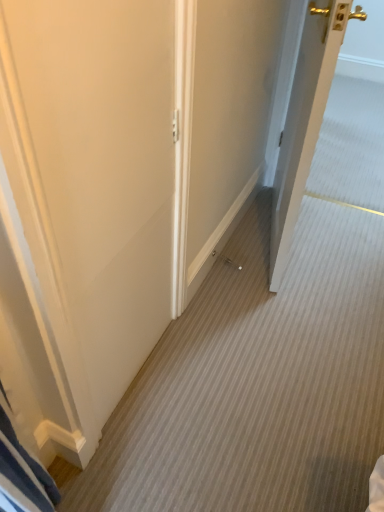
Question: Which direction should I rotate to look at white matte door at center, marked as the second door in a right-to-left arrangement, — up or down?

Choices:
 (A) down
 (B) up

Answer: (B)

Question: From a real-world perspective, is white wood door at right, placed as the 2th door when sorted from left to right, beneath white matte door at center, marked as the second door in a right-to-left arrangement?

Choices:
 (A) yes
 (B) no

Answer: (A)

Question: Is white wood door at right, the first door positioned from the right, further to camera compared to white matte door at center, the 1th door when ordered from left to right?

Choices:
 (A) no
 (B) yes

Answer: (B)

Question: Does white wood door at right, the first door positioned from the right, have a greater width compared to white matte door at center, marked as the second door in a right-to-left arrangement?

Choices:
 (A) no
 (B) yes

Answer: (B)

Question: From the image's perspective, is white wood door at right, the first door positioned from the right, above white matte door at center, marked as the second door in a right-to-left arrangement?

Choices:
 (A) no
 (B) yes

Answer: (B)

Question: Considering the relative sizes of white wood door at right, placed as the 2th door when sorted from left to right, and white matte door at center, the 1th door when ordered from left to right, in the image provided, is white wood door at right, placed as the 2th door when sorted from left to right, smaller than white matte door at center, the 1th door when ordered from left to right,?

Choices:
 (A) yes
 (B) no

Answer: (B)

Question: Is white wood door at right, placed as the 2th door when sorted from left to right, to the left of white matte door at center, marked as the second door in a right-to-left arrangement, from the viewer's perspective?

Choices:
 (A) no
 (B) yes

Answer: (A)

Question: Does white matte door at center, the 1th door when ordered from left to right, have a larger size compared to white wood door at right, placed as the 2th door when sorted from left to right?

Choices:
 (A) yes
 (B) no

Answer: (B)

Question: From a real-world perspective, is white matte door at center, marked as the second door in a right-to-left arrangement, located higher than white wood door at right, the first door positioned from the right?

Choices:
 (A) no
 (B) yes

Answer: (B)

Question: From the image's perspective, is white matte door at center, the 1th door when ordered from left to right, on top of white wood door at right, the first door positioned from the right?

Choices:
 (A) yes
 (B) no

Answer: (B)

Question: From a real-world perspective, is white matte door at center, the 1th door when ordered from left to right, located beneath white wood door at right, the first door positioned from the right?

Choices:
 (A) yes
 (B) no

Answer: (B)

Question: Is white matte door at center, marked as the second door in a right-to-left arrangement, not near white wood door at right, the first door positioned from the right?

Choices:
 (A) no
 (B) yes

Answer: (A)

Question: Is white matte door at center, the 1th door when ordered from left to right, at the left side of white wood door at right, the first door positioned from the right?

Choices:
 (A) no
 (B) yes

Answer: (B)

Question: Considering the positions of white wood door at right, placed as the 2th door when sorted from left to right, and white matte door at center, the 1th door when ordered from left to right, in the image, is white wood door at right, placed as the 2th door when sorted from left to right, taller or shorter than white matte door at center, the 1th door when ordered from left to right,?

Choices:
 (A) tall
 (B) short

Answer: (B)